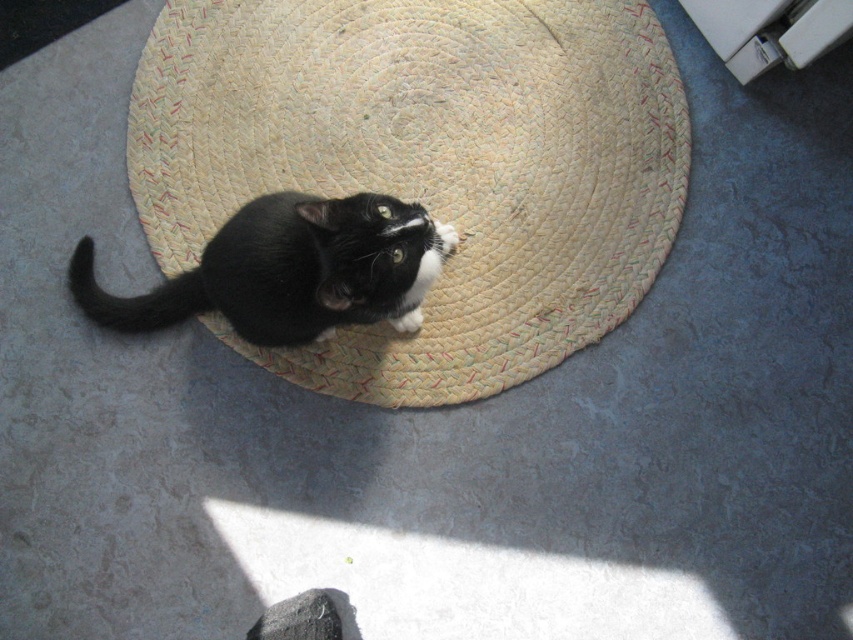
I want to click on natural woven straw hat at center, so click(x=426, y=164).

Does natural woven straw hat at center appear on the right side of black matte fur cat at center?

Indeed, natural woven straw hat at center is positioned on the right side of black matte fur cat at center.

Locate an element on the screen. natural woven straw hat at center is located at coordinates click(426, 164).